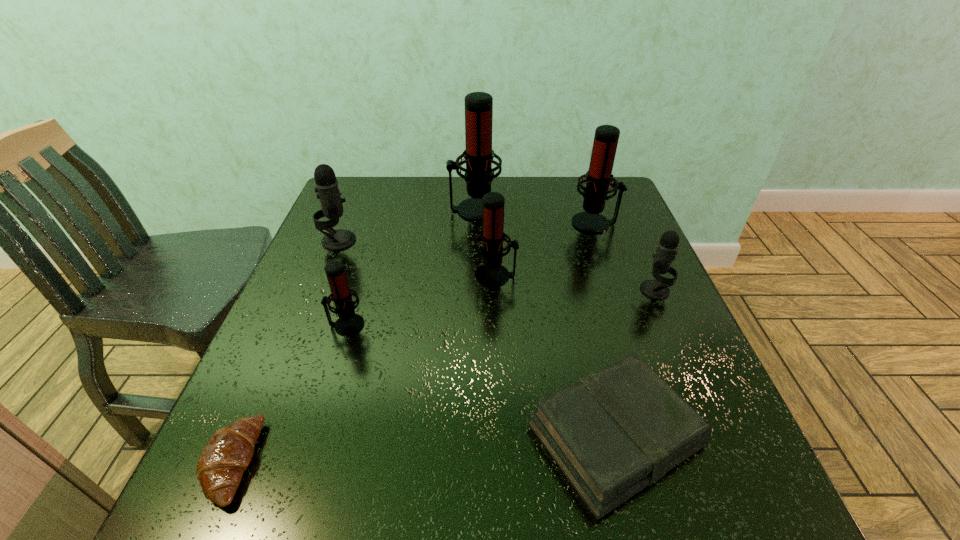
The width and height of the screenshot is (960, 540). Find the location of `vacant space located on the front of the right black microphone`. vacant space located on the front of the right black microphone is located at coordinates (711, 420).

Find the location of a particular element. The height and width of the screenshot is (540, 960). free space located 0.090m on the back of the greenish book is located at coordinates (589, 334).

Image resolution: width=960 pixels, height=540 pixels. I want to click on vacant space situated 0.250m on the right of the crescent roll, so click(x=411, y=462).

The height and width of the screenshot is (540, 960). I want to click on book at the near edge, so click(612, 433).

Where is `crescent roll at the near edge`? The width and height of the screenshot is (960, 540). crescent roll at the near edge is located at coordinates (226, 456).

I want to click on crescent roll present at the left edge, so click(226, 456).

This screenshot has width=960, height=540. Identify the location of book at the right edge. (612, 433).

Locate an element on the screen. The height and width of the screenshot is (540, 960). object situated at the near left corner is located at coordinates [226, 456].

In order to click on object at the far right corner in this screenshot , I will do `click(598, 179)`.

Locate an element on the screen. Image resolution: width=960 pixels, height=540 pixels. object present at the near right corner is located at coordinates (612, 433).